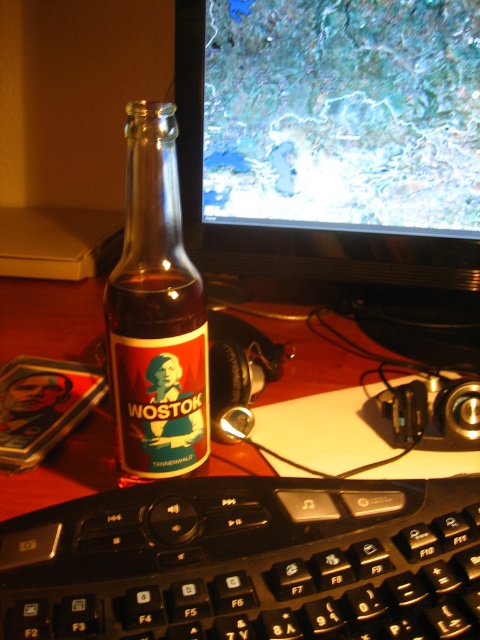
In the scene shown: You are a photographer trying to capture a closeup of the black plastic keyboard at lower center. You need to position your camera so that it is exactly 12 inches away from the keyboard. Based on the current setup, is the camera too close or too far from the keyboard?

The black plastic keyboard at lower center is currently 10.70 inches away from the camera. Since you need to be 12 inches away, the camera is too close and needs to be moved back approximately 1.3 inches.

You are organizing your desk and need to place both the black plastic keyboard at lower center and the translucent glass bottle at center. Since space is limited, which object should you prioritize keeping on the desk?

The black plastic keyboard at lower center is bigger than the translucent glass bottle at center, so you should prioritize keeping the black plastic keyboard at lower center on the desk because it takes up more space and might be more essential for daily use.

You are organizing items on a desk and need to place a smartphone between the black plastic keyboard at lower center and the translucent glass bottle at center. Given that the smartphone is 2.5 inches wide, will it fit in the space between them?

The space between the black plastic keyboard at lower center and the translucent glass bottle at center is 4.36 inches. Since the smartphone is 2.5 inches wide, it will fit comfortably in the available space.